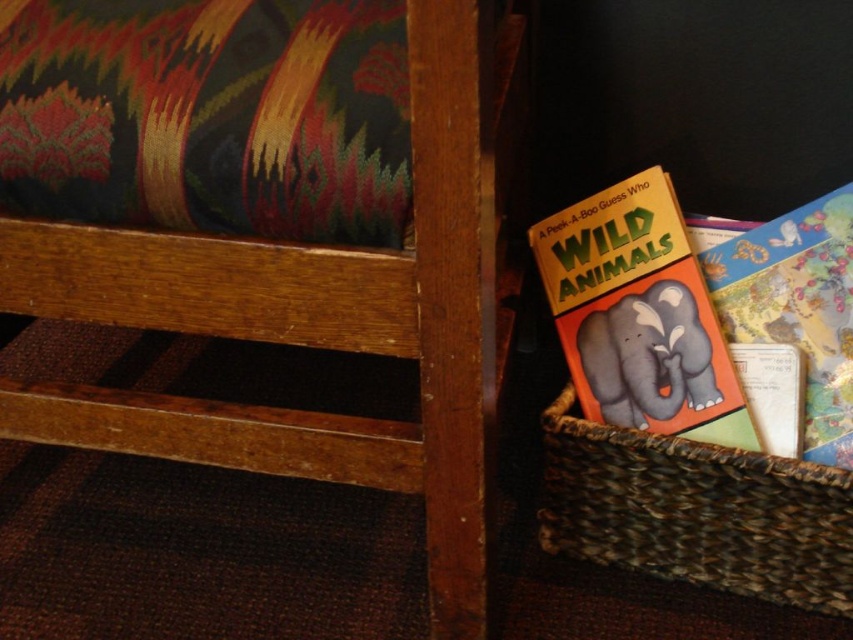
Question: Can you confirm if wooden stool at lower left is positioned to the right of matte orange book at lower right?

Choices:
 (A) yes
 (B) no

Answer: (B)

Question: Can you confirm if wooden stool at lower left is positioned to the right of matte yellow book at lower right?

Choices:
 (A) no
 (B) yes

Answer: (A)

Question: Which point is closer to the camera taking this photo?

Choices:
 (A) (32, 0)
 (B) (482, 493)
 (C) (657, 397)

Answer: (A)

Question: Which of the following is the closest to the observer?

Choices:
 (A) (35, 138)
 (B) (161, 449)

Answer: (A)

Question: Does matte yellow book at lower right have a greater width compared to matte orange book at lower right?

Choices:
 (A) no
 (B) yes

Answer: (B)

Question: Which point is closer to the camera?

Choices:
 (A) (228, 195)
 (B) (589, 381)
 (C) (820, 252)

Answer: (A)